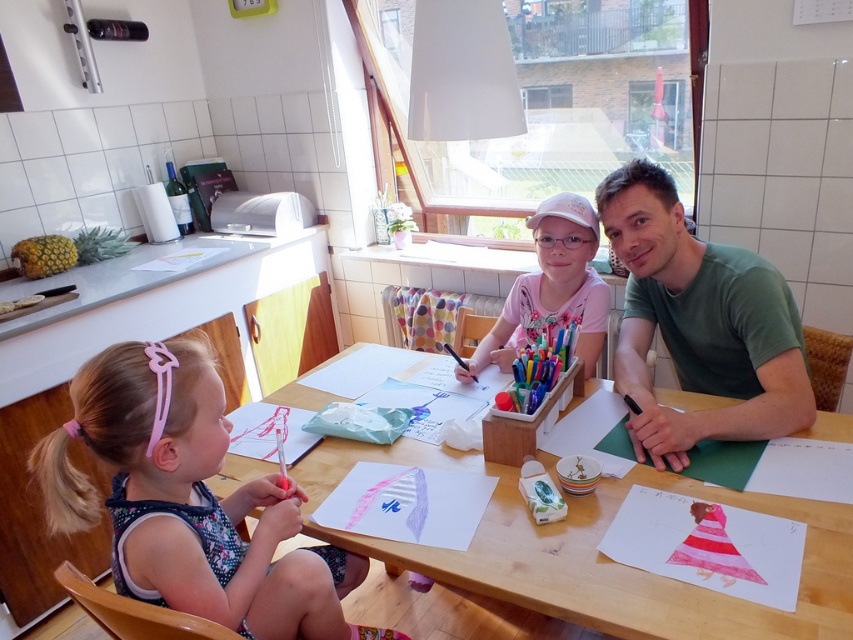
Question: Is green cotton shirt at upper right positioned behind pink fabric shirt at center?

Choices:
 (A) no
 (B) yes

Answer: (A)

Question: Based on their relative distances, which object is nearer to the floral dress at lower left?

Choices:
 (A) wooden table at center
 (B) pink fabric shirt at center
 (C) green cotton shirt at upper right

Answer: (A)

Question: Which of these objects is positioned closest to the wooden table at center?

Choices:
 (A) floral dress at lower left
 (B) green cotton shirt at upper right
 (C) pink fabric shirt at center

Answer: (A)

Question: Does wooden table at center appear over green cotton shirt at upper right?

Choices:
 (A) no
 (B) yes

Answer: (A)

Question: Is wooden table at center above pink fabric shirt at center?

Choices:
 (A) yes
 (B) no

Answer: (B)

Question: Considering the real-world distances, which object is farthest from the wooden table at center?

Choices:
 (A) pink fabric shirt at center
 (B) floral dress at lower left

Answer: (A)